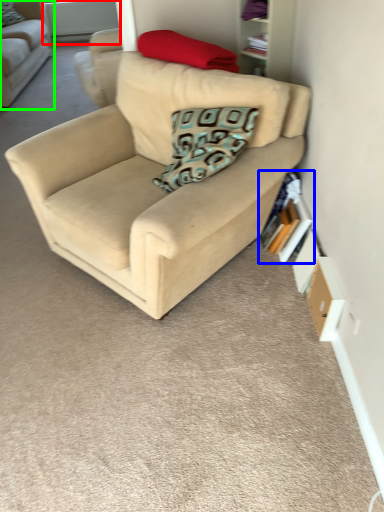
Question: Which is nearer to the window screen (highlighted by a red box)? book (highlighted by a blue box) or studio couch (highlighted by a green box).

Choices:
 (A) book
 (B) studio couch

Answer: (B)